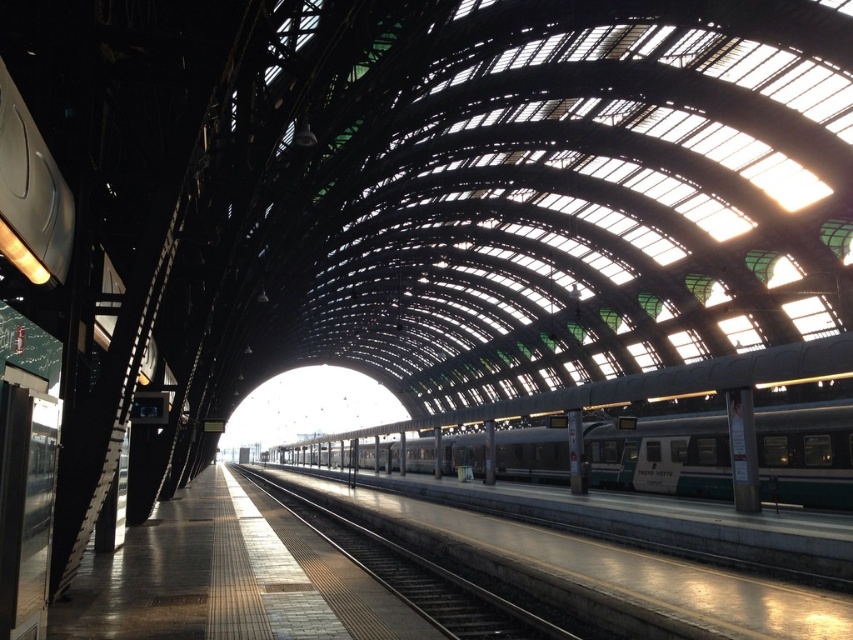
Which of these two, teal metallic train at center or metal train track at center, stands taller?

With more height is teal metallic train at center.

Is point (605, 452) closer to viewer compared to point (396, 544)?

No, (605, 452) is behind (396, 544).

Where is `teal metallic train at center`? teal metallic train at center is located at coordinates (662, 456).

You are a GUI agent. You are given a task and a screenshot of the screen. Output one action in this format:
    pyautogui.click(x=<x>, y=<y>)
    Task: Click on the teal metallic train at center
    This screenshot has width=853, height=640.
    Given the screenshot: What is the action you would take?
    pos(662,456)